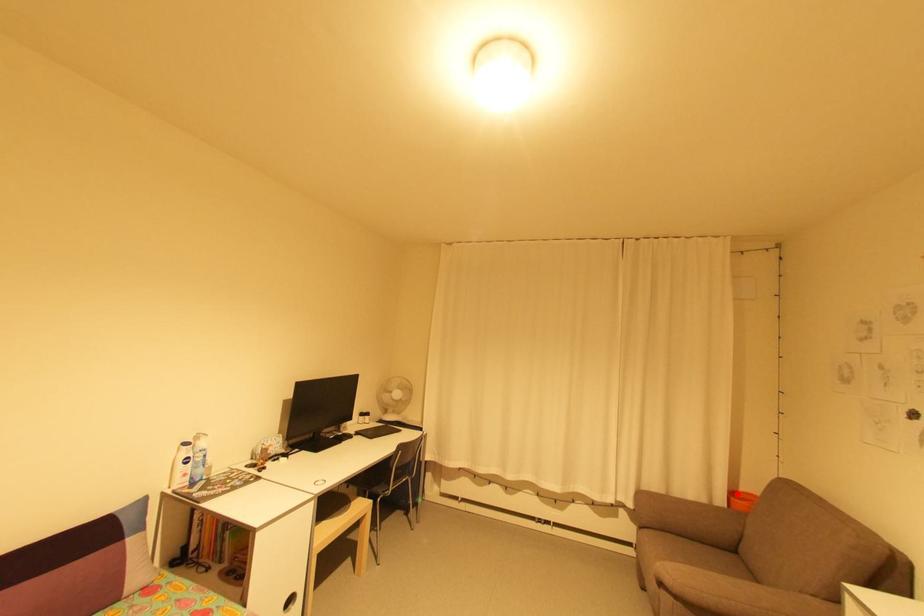
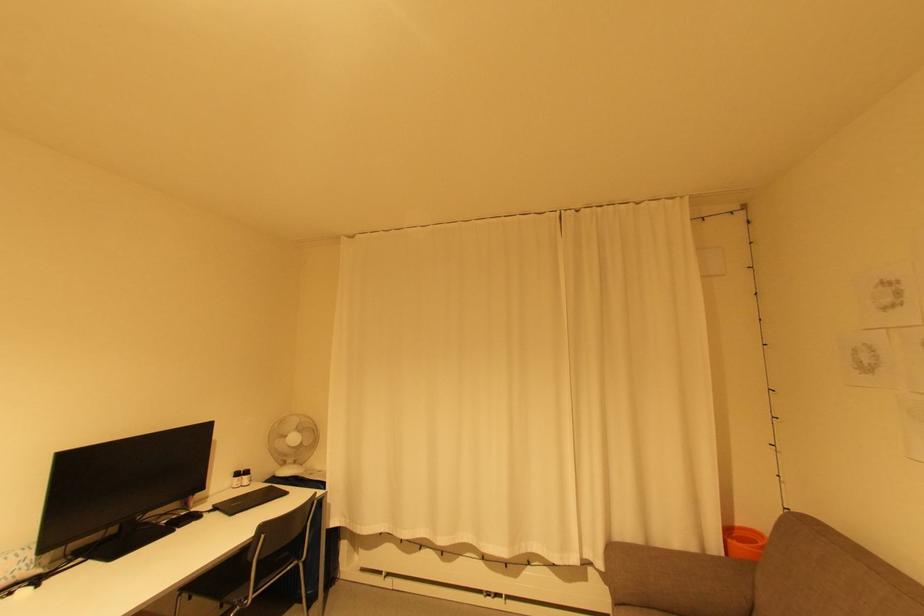
The point at the highlighted location is marked in the first image. Where is the corresponding point in the second image?

(733, 533)